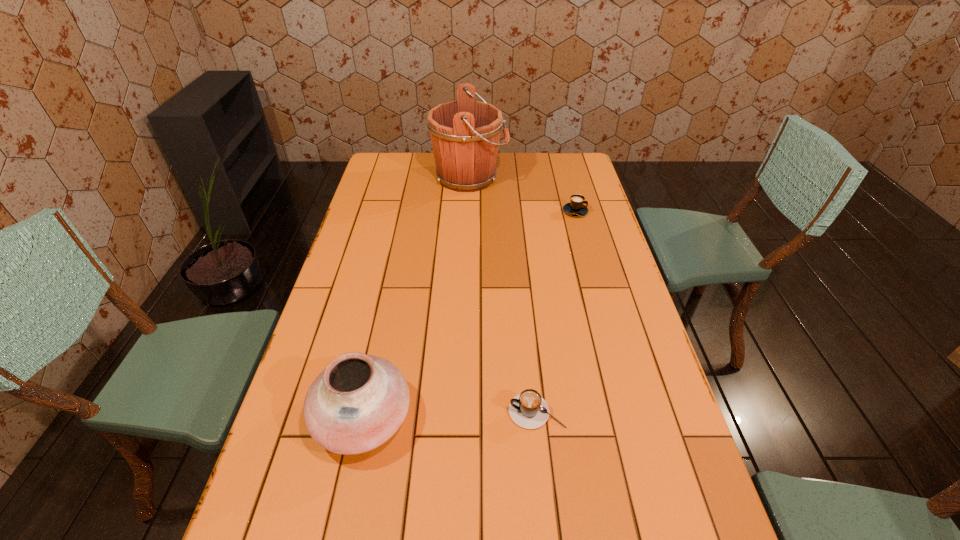
Find the location of `vacant space located 0.120m with the handle on the side of the nearer cappuccino`. vacant space located 0.120m with the handle on the side of the nearer cappuccino is located at coordinates (459, 411).

I want to click on free point located 0.260m with the handle on the side of the nearer cappuccino, so click(400, 411).

The width and height of the screenshot is (960, 540). I want to click on object that is at the far edge, so click(x=465, y=133).

At what (x,y) coordinates should I click in order to perform the action: click on object at the left edge. Please return your answer as a coordinate pair (x, y). The height and width of the screenshot is (540, 960). Looking at the image, I should click on (358, 402).

Find the location of a particular element. The height and width of the screenshot is (540, 960). object that is at the right edge is located at coordinates 576,207.

Find the location of a particular element. Image resolution: width=960 pixels, height=540 pixels. vacant space at the far edge of the desktop is located at coordinates (499, 168).

Locate an element on the screen. This screenshot has width=960, height=540. vacant space at the left edge of the desktop is located at coordinates (352, 244).

The image size is (960, 540). In the image, there is a desktop. What are the coordinates of `vacant space at the right edge` in the screenshot? It's located at (602, 309).

The height and width of the screenshot is (540, 960). I want to click on vacant region at the far left corner of the desktop, so click(379, 174).

Image resolution: width=960 pixels, height=540 pixels. Identify the location of empty space between the right cappuccino and the pottery. (469, 314).